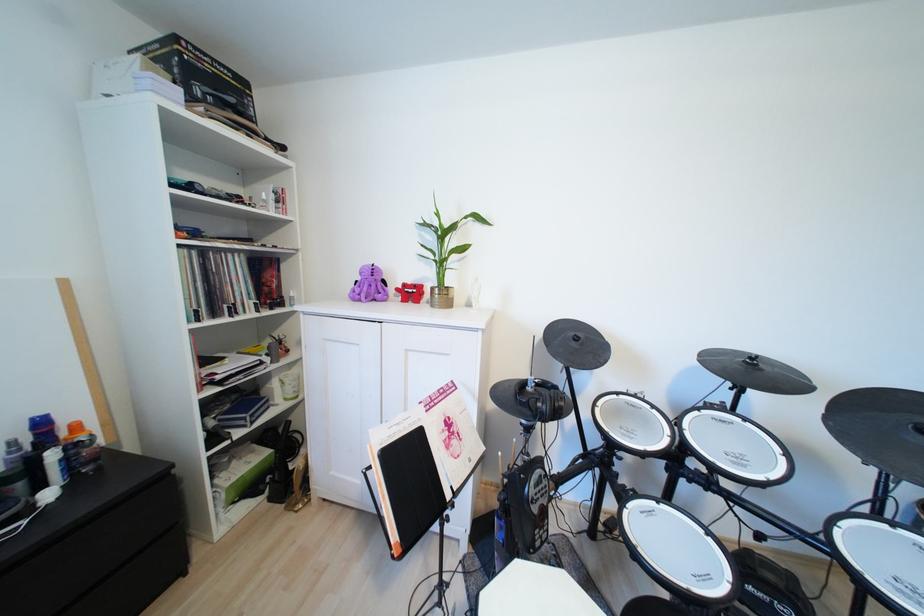
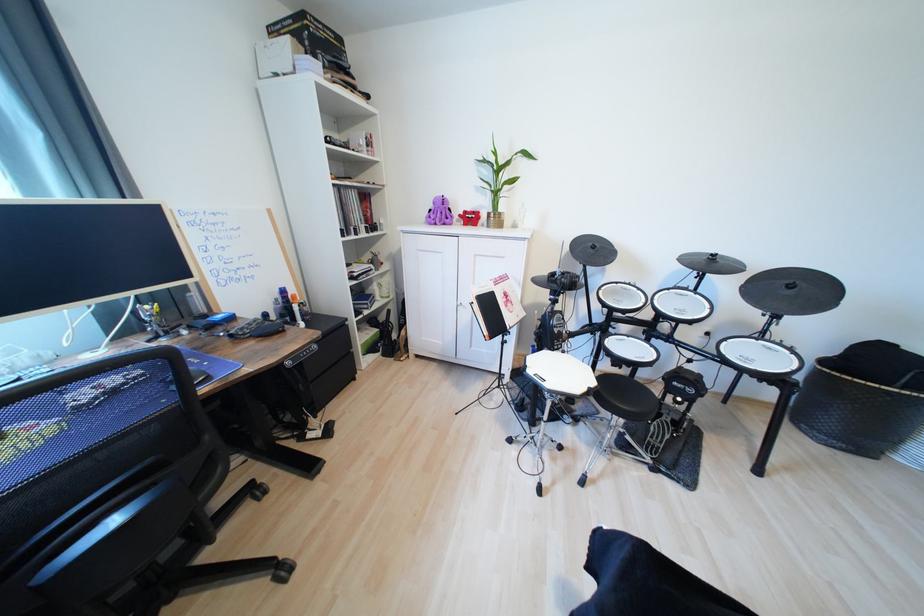
Where in the second image is the point corresponding to (x=411, y=286) from the first image?

(472, 214)